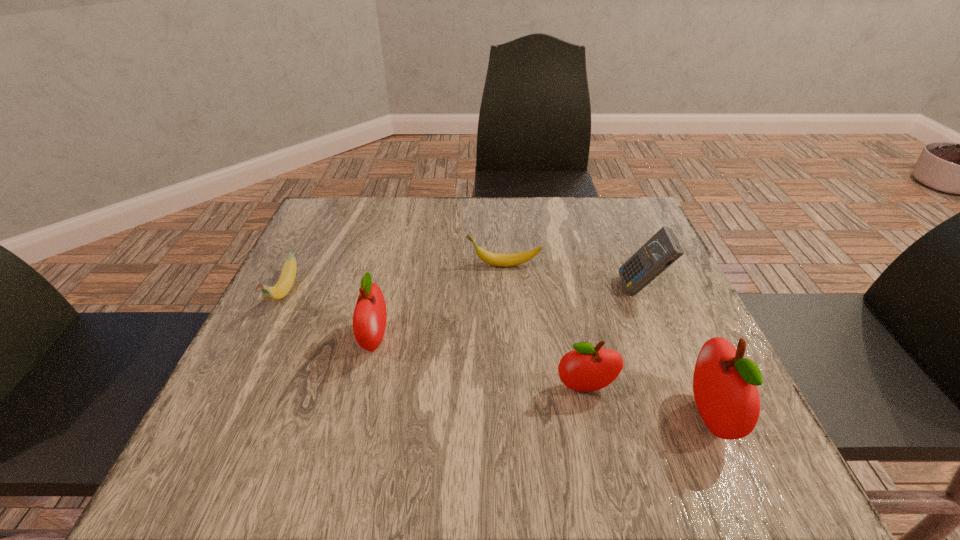
The image size is (960, 540). Identify the location of the second tallest apple. (370, 315).

Identify the location of the farthest apple. Image resolution: width=960 pixels, height=540 pixels. (370, 315).

The height and width of the screenshot is (540, 960). Identify the location of the shortest apple. (587, 368).

Where is `the third shortest object`? The image size is (960, 540). the third shortest object is located at coordinates (587, 368).

Locate an element on the screen. the rightmost apple is located at coordinates (725, 384).

I want to click on calculator, so click(663, 249).

The height and width of the screenshot is (540, 960). Identify the location of the left banana. (283, 286).

Where is `the right banana`? This screenshot has height=540, width=960. the right banana is located at coordinates (503, 260).

You are a GUI agent. You are given a task and a screenshot of the screen. Output one action in this format:
    pyautogui.click(x=<x>, y=<y>)
    Task: Click on the vacant space located 0.090m on the left of the second object from left to right
    
    Given the screenshot: What is the action you would take?
    pyautogui.click(x=316, y=341)

Locate an element on the screen. free spot located 0.170m on the back of the third shortest object is located at coordinates (568, 311).